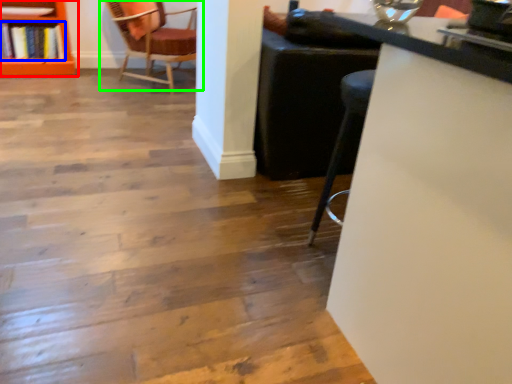
Question: Which is farther away from shelf (highlighted by a red box)? book (highlighted by a blue box) or chair (highlighted by a green box)?

Choices:
 (A) book
 (B) chair

Answer: (B)